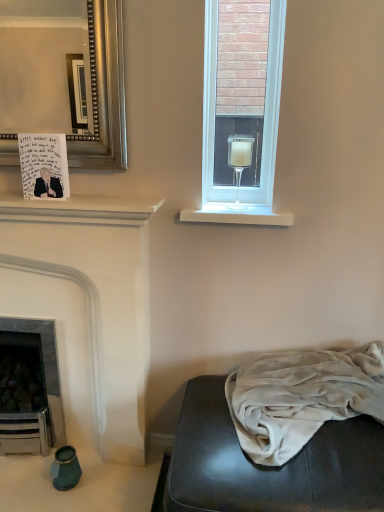
Where is `free location above white smooth window sill at upper right (from a real-world perspective)`? free location above white smooth window sill at upper right (from a real-world perspective) is located at coordinates (240, 210).